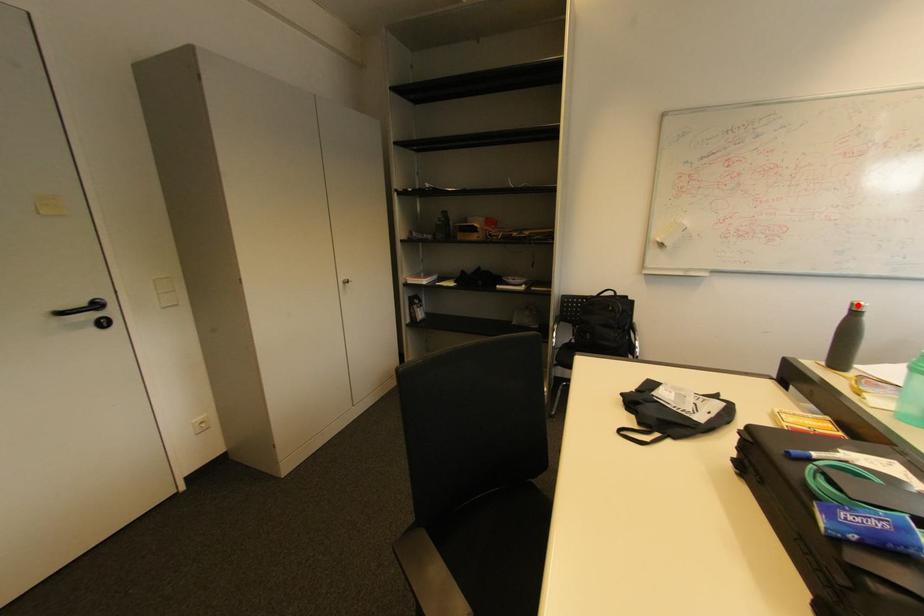
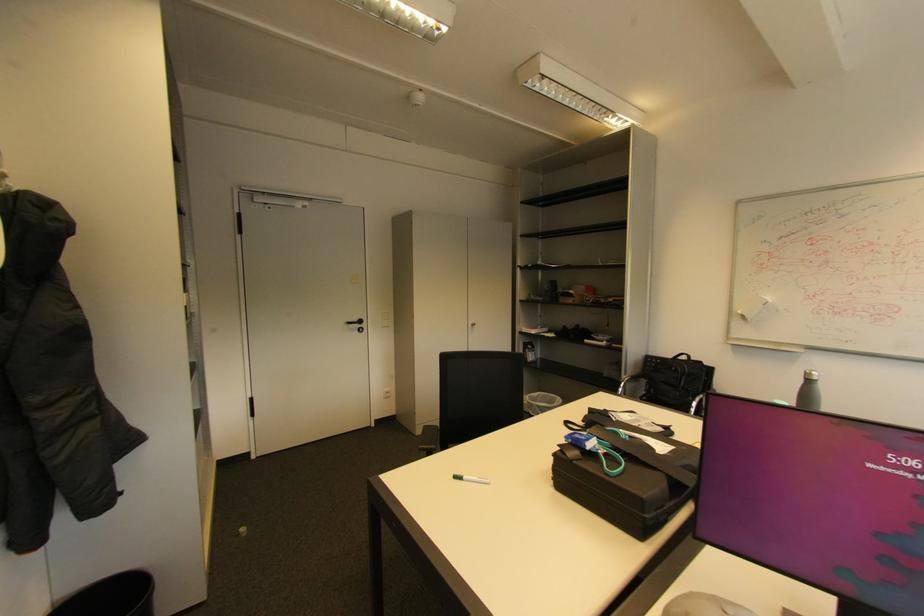
Find the pixel in the second image that matches the highlighted location in the first image.

(811, 373)